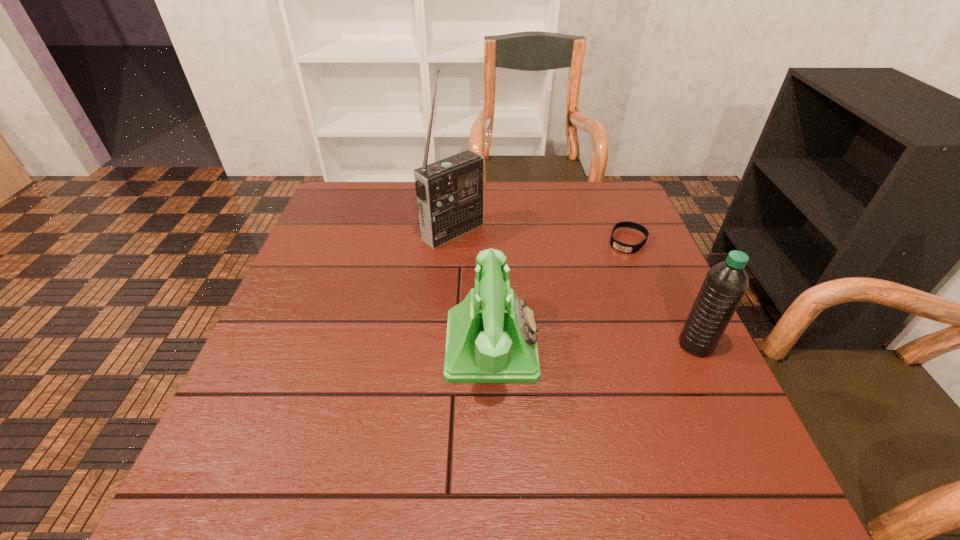
Where is `vacant space located on the display of the shortest object`? The height and width of the screenshot is (540, 960). vacant space located on the display of the shortest object is located at coordinates (587, 312).

The height and width of the screenshot is (540, 960). Identify the location of vacant position located 0.320m on the display of the shortest object. (575, 332).

Where is `object positioned at the far edge`? This screenshot has width=960, height=540. object positioned at the far edge is located at coordinates (450, 193).

Where is `object present at the near edge`? The width and height of the screenshot is (960, 540). object present at the near edge is located at coordinates (491, 337).

The width and height of the screenshot is (960, 540). Find the location of `water bottle present at the right edge`. water bottle present at the right edge is located at coordinates (725, 284).

Where is `wristband at the right edge`? This screenshot has height=540, width=960. wristband at the right edge is located at coordinates (630, 249).

Where is `free spot at the far edge of the desktop`? free spot at the far edge of the desktop is located at coordinates (573, 192).

Locate an element on the screen. free location at the left edge of the desktop is located at coordinates (340, 288).

Identify the location of vacant space at the right edge of the desktop. The width and height of the screenshot is (960, 540). (618, 285).

The height and width of the screenshot is (540, 960). In the image, there is a desktop. Identify the location of vacant space at the near left corner. [272, 438].